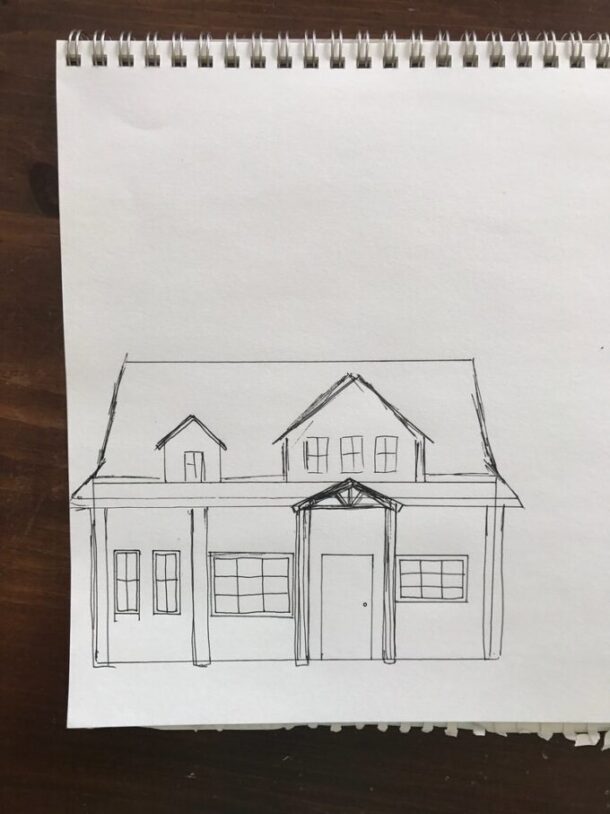
In order to click on window in this screenshot , I will do `click(265, 580)`.